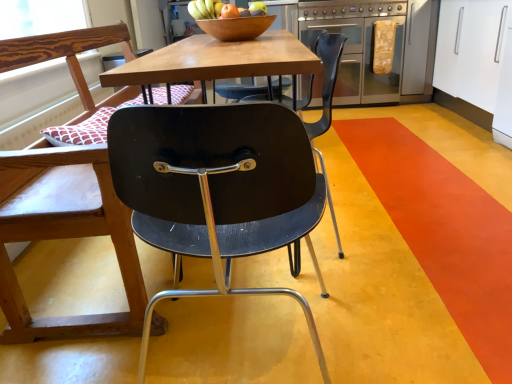
Measure the distance between wooden bowl at center and camera.

The depth of wooden bowl at center is 5.83 feet.

What do you see at coordinates (214, 186) in the screenshot?
I see `matte black chair at center, the 2th chair from the left` at bounding box center [214, 186].

This screenshot has width=512, height=384. Describe the element at coordinates (223, 9) in the screenshot. I see `shiny wooden bowl at upper center` at that location.

The height and width of the screenshot is (384, 512). Identify the location of matte black chair at left, which appears as the first chair when viewed from the left. (64, 233).

Image resolution: width=512 pixels, height=384 pixels. Find the location of `stainless steel oven at center right`. stainless steel oven at center right is located at coordinates (358, 46).

Locate an element on the screen. orange vinyl stripe at lower right is located at coordinates (444, 232).

From a real-world perspective, is white glossy cabinet at upper right physically located above or below orange vinyl stripe at lower right?

white glossy cabinet at upper right is situated higher than orange vinyl stripe at lower right in the real world.

Which is more to the left, white glossy cabinet at upper right or orange vinyl stripe at lower right?

Positioned to the left is orange vinyl stripe at lower right.

Identify the location of stripe located below the white glossy cabinet at upper right (from the image's perspective). The image size is (512, 384). (444, 232).

From the image's perspective, is white glossy cabinet at upper right above or below orange vinyl stripe at lower right?

Clearly, from the image's perspective, white glossy cabinet at upper right is above orange vinyl stripe at lower right.

Can you confirm if white glossy cabinet at upper right is shorter than matte brown apple at center?

Incorrect, the height of white glossy cabinet at upper right does not fall short of that of matte brown apple at center.

From a real-world perspective, which object stands above the other?

In real-world perspective, matte brown apple at center is above.

Looking at this image, which object is positioned more to the left, white glossy cabinet at upper right or matte brown apple at center?

matte brown apple at center is more to the left.

Is white glossy cabinet at upper right positioned in front of matte black chair at left, which is counted as the 2th chair, starting from the right?

No, white glossy cabinet at upper right is behind matte black chair at left, which is counted as the 2th chair, starting from the right.

Is point (469, 101) behind point (50, 39)?

Yes.

Is white glossy cabinet at upper right to the right of matte black chair at left, which is counted as the 2th chair, starting from the right, from the viewer's perspective?

Yes, white glossy cabinet at upper right is to the right of matte black chair at left, which is counted as the 2th chair, starting from the right.

Locate an element on the screen. the 1st chair located beneath the white glossy cabinet at upper right (from a real-world perspective) is located at coordinates (64, 233).

Is wooden bowl at center far from matte brown apple at center?

No, wooden bowl at center is not far from matte brown apple at center.

Locate an element on the screen. bowl in front of the matte brown apple at center is located at coordinates (236, 27).

Based on the photo, what's the angular difference between wooden bowl at center and matte brown apple at center's facing directions?

wooden bowl at center and matte brown apple at center are facing 90 degrees away from each other.

Considering the positions of objects wooden bowl at center and matte brown apple at center in the image provided, who is more to the right, wooden bowl at center or matte brown apple at center?

From the viewer's perspective, matte brown apple at center appears more on the right side.

Would you say matte brown apple at center is to the left or to the right of matte black chair at left, which appears as the first chair when viewed from the left, in the picture?

Based on their positions, matte brown apple at center is located to the right of matte black chair at left, which appears as the first chair when viewed from the left.

Is matte brown apple at center oriented away from matte black chair at left, which is counted as the 2th chair, starting from the right?

matte brown apple at center does not have its back to matte black chair at left, which is counted as the 2th chair, starting from the right.

Considering the relative sizes of matte brown apple at center and matte black chair at left, which is counted as the 2th chair, starting from the right, in the image provided, is matte brown apple at center bigger than matte black chair at left, which is counted as the 2th chair, starting from the right,?

Incorrect, matte brown apple at center is not larger than matte black chair at left, which is counted as the 2th chair, starting from the right.

From a real-world perspective, between matte brown apple at center and matte black chair at left, which is counted as the 2th chair, starting from the right, who is vertically lower?

matte black chair at left, which is counted as the 2th chair, starting from the right, from a real-world perspective.

Consider the image. What's the angular difference between wooden bowl at center and matte black chair at center, the 2th chair from the left,'s facing directions?

93.6 degrees.

From the picture: Measure the distance from wooden bowl at center to matte black chair at center, the 1th chair viewed from the right.

3.72 feet.

Are wooden bowl at center and matte black chair at center, the 1th chair viewed from the right, beside each other?

No.

Which object is closer to the camera taking this photo, wooden bowl at center or matte black chair at center, the 1th chair viewed from the right?

matte black chair at center, the 1th chair viewed from the right, is closer to the camera.

Locate an element on the screen. chair that is the 2nd one when counting downward from the shiny wooden bowl at upper center (from the image's perspective) is located at coordinates (214, 186).

From a real-world perspective, does shiny wooden bowl at upper center stand above matte black chair at center, the 2th chair from the left?

Indeed, from a real-world perspective, shiny wooden bowl at upper center stands above matte black chair at center, the 2th chair from the left.

Visually, is shiny wooden bowl at upper center positioned to the left or to the right of matte black chair at center, the 2th chair from the left?

Clearly, shiny wooden bowl at upper center is on the left of matte black chair at center, the 2th chair from the left, in the image.

Can you confirm if shiny wooden bowl at upper center is thinner than matte black chair at center, the 1th chair viewed from the right?

Yes, shiny wooden bowl at upper center is thinner than matte black chair at center, the 1th chair viewed from the right.

Locate an element on the screen. The width and height of the screenshot is (512, 384). cabinetry behind the orange vinyl stripe at lower right is located at coordinates (470, 49).

Where is `cabinetry on the right side of matte brown apple at center`? cabinetry on the right side of matte brown apple at center is located at coordinates (470, 49).

Looking at the image, which one is located further to matte brown apple at center, white glossy cabinet at upper right or matte black chair at center, the 2th chair from the left?

Among the two, white glossy cabinet at upper right is located further to matte brown apple at center.

From the image, which object appears to be nearer to stainless steel oven at center right, matte brown apple at center or matte black chair at center, the 1th chair viewed from the right?

matte brown apple at center lies closer to stainless steel oven at center right than the other object.

Which object lies further to the anchor point matte black chair at center, the 2th chair from the left, wooden bowl at center or shiny wooden bowl at upper center?

shiny wooden bowl at upper center.

Based on their spatial positions, is matte black chair at center, the 1th chair viewed from the right, or wooden bowl at center closer to stainless steel oven at center right?

wooden bowl at center lies closer to stainless steel oven at center right than the other object.

Estimate the real-world distances between objects in this image. Which object is further from matte black chair at left, which is counted as the 2th chair, starting from the right, matte black chair at center, the 1th chair viewed from the right, or shiny wooden bowl at upper center?

shiny wooden bowl at upper center lies further to matte black chair at left, which is counted as the 2th chair, starting from the right, than the other object.

When comparing their distances from stainless steel oven at center right, does wooden bowl at center or orange vinyl stripe at lower right seem further?

Among the two, wooden bowl at center is located further to stainless steel oven at center right.

Looking at the image, which one is located closer to matte brown apple at center, orange vinyl stripe at lower right or white glossy cabinet at upper right?

The object closer to matte brown apple at center is orange vinyl stripe at lower right.

Estimate the real-world distances between objects in this image. Which object is closer to orange vinyl stripe at lower right, wooden bowl at center or shiny wooden bowl at upper center?

The object closer to orange vinyl stripe at lower right is wooden bowl at center.

This screenshot has width=512, height=384. In order to click on chair between matte black chair at center, the 1th chair viewed from the right, and stainless steel oven at center right in the front-back direction in this screenshot , I will do `click(64, 233)`.

This screenshot has width=512, height=384. Find the location of `fruit located between matte brown apple at center and stainless steel oven at center right in the depth direction`. fruit located between matte brown apple at center and stainless steel oven at center right in the depth direction is located at coordinates (223, 9).

The height and width of the screenshot is (384, 512). I want to click on apple between matte black chair at center, the 2th chair from the left, and shiny wooden bowl at upper center, along the z-axis, so click(229, 11).

At what (x,y) coordinates should I click in order to perform the action: click on apple positioned between orange vinyl stripe at lower right and stainless steel oven at center right from near to far. Please return your answer as a coordinate pair (x, y). The width and height of the screenshot is (512, 384). Looking at the image, I should click on (229, 11).